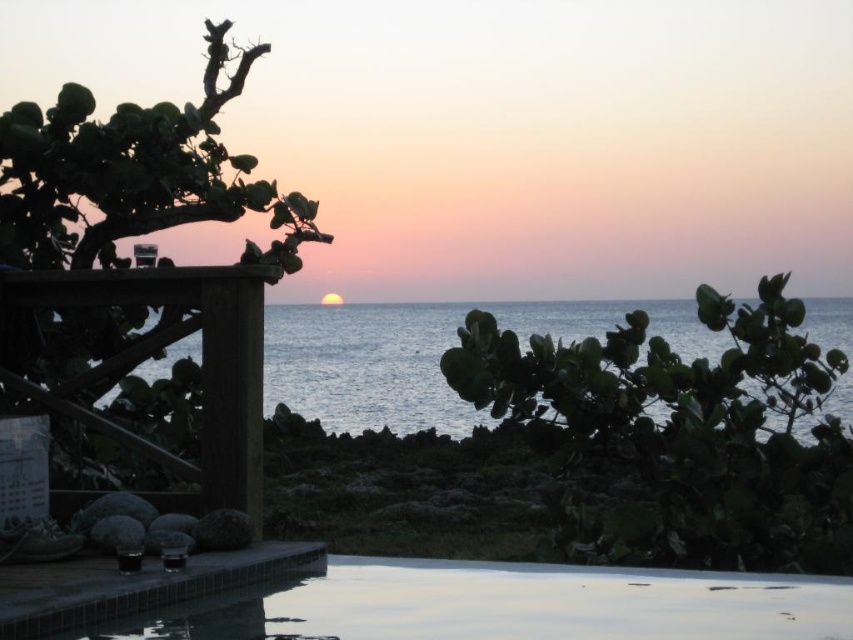
You are standing at the center of the image and want to walk to the smooth concrete pool at center. In which direction should you move?

You should move towards the center of the image since the smooth concrete pool at center is located there.

Based on the scene description, where is the smooth concrete pool at center located in terms of its 2D coordinates?

The smooth concrete pool at center is located at the 2D coordinates of point (436, 602).